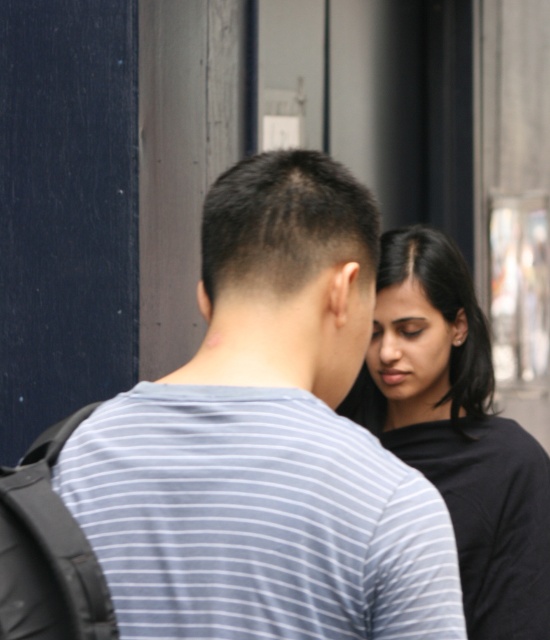
Question: Is gray striped shirt at center above black matte shirt at right?

Choices:
 (A) yes
 (B) no

Answer: (A)

Question: Does gray striped shirt at center appear over black matte shirt at right?

Choices:
 (A) no
 (B) yes

Answer: (B)

Question: Among these points, which one is nearest to the camera?

Choices:
 (A) (177, 500)
 (B) (474, 301)

Answer: (A)

Question: Is gray striped shirt at center bigger than black matte shirt at right?

Choices:
 (A) yes
 (B) no

Answer: (A)